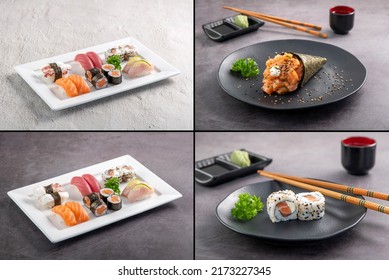
The height and width of the screenshot is (280, 389). I want to click on brown chopstick, so click(x=358, y=201).